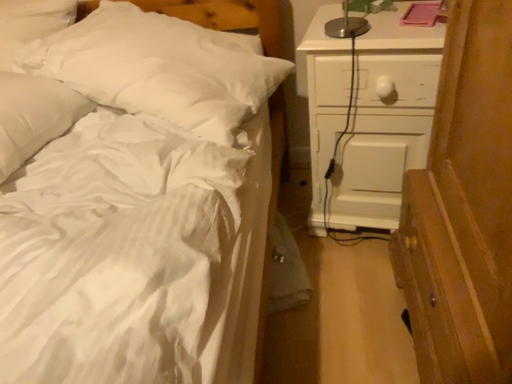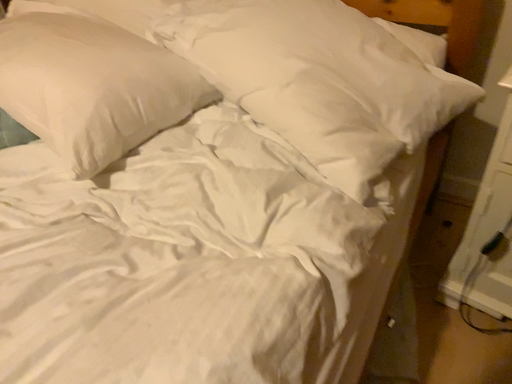
Question: Which way did the camera rotate in the video?

Choices:
 (A) rotated left
 (B) rotated right

Answer: (A)